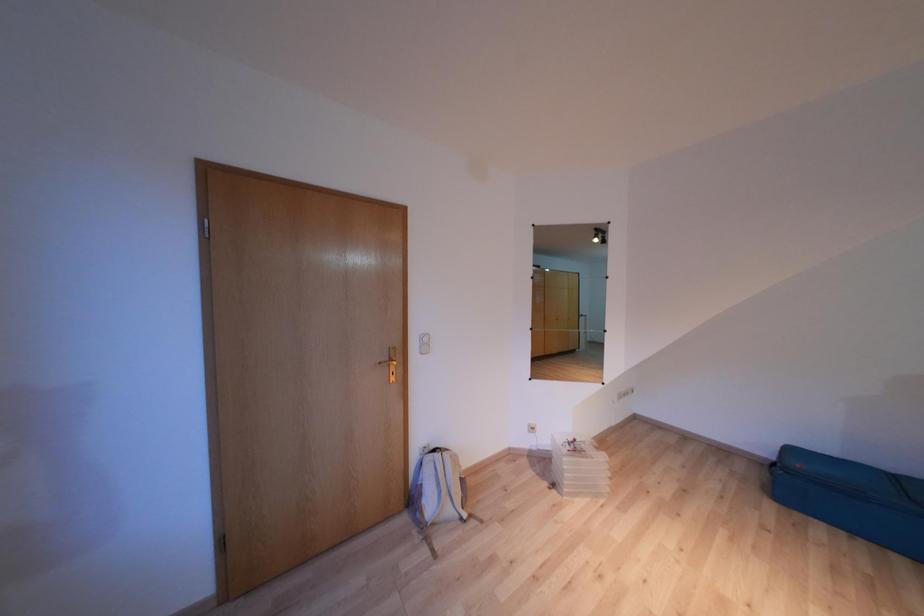
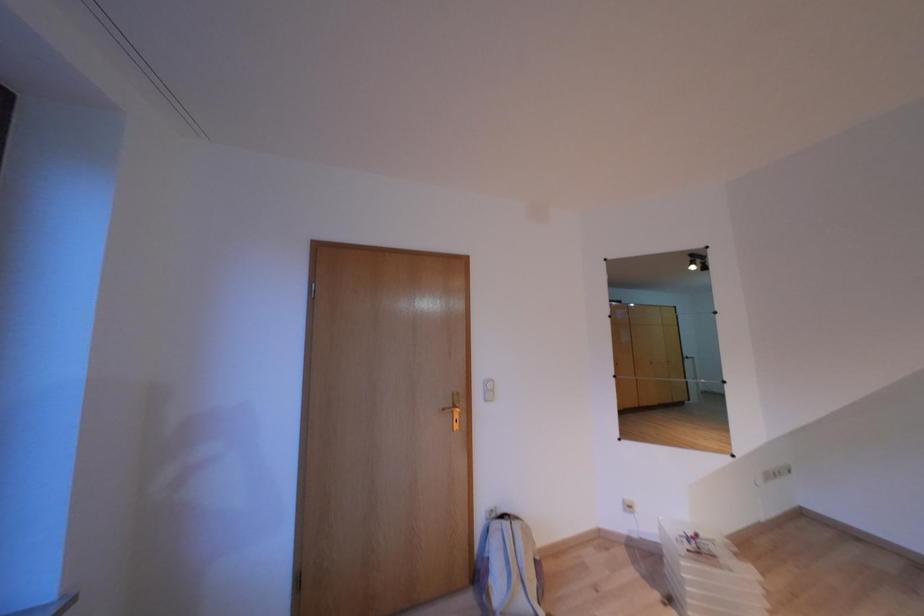
Question: The first image is from the beginning of the video and the second image is from the end. How did the camera likely rotate when shooting the video?

Choices:
 (A) Left
 (B) Right
 (C) Up
 (D) Down

Answer: (A)